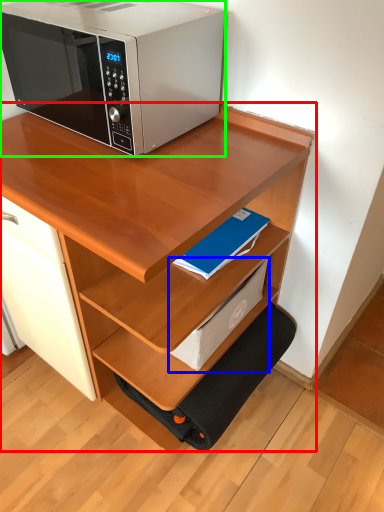
Question: Estimate the real-world distances between objects in this image. Which object is closer to desk (highlighted by a red box), paperback book (highlighted by a blue box) or microwave oven (highlighted by a green box)?

Choices:
 (A) paperback book
 (B) microwave oven

Answer: (A)